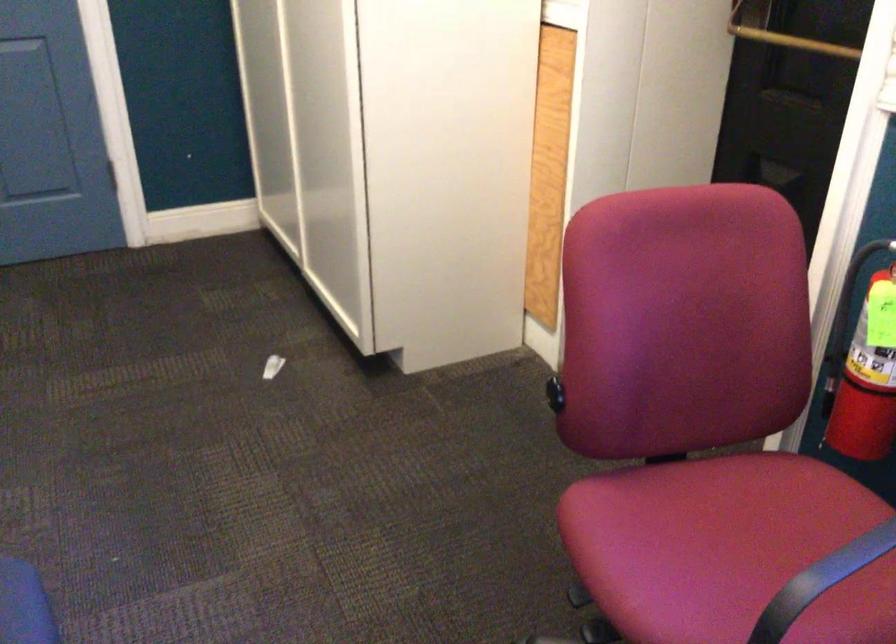
Image resolution: width=896 pixels, height=644 pixels. I want to click on pink chair sitting surface, so click(709, 511).